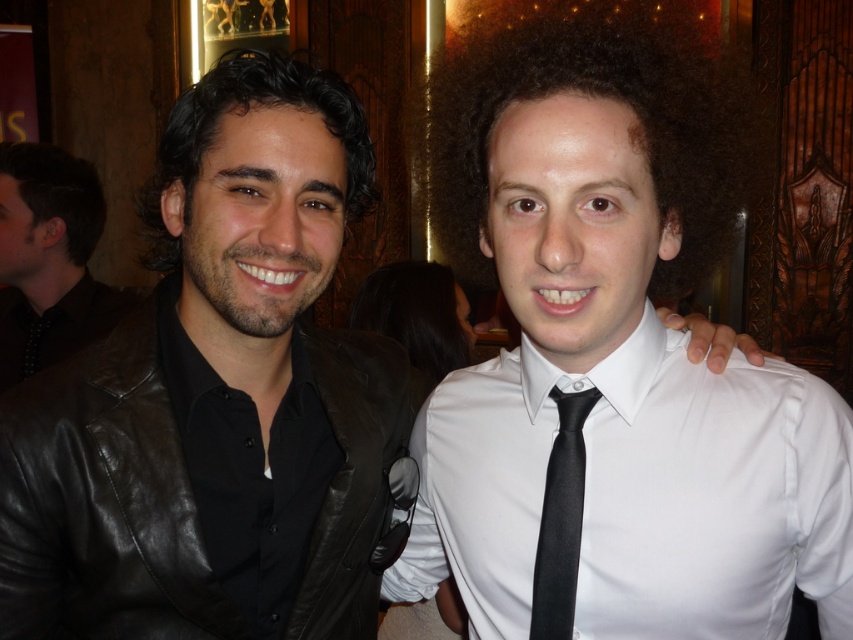
Can you confirm if black leather jacket at left is positioned below matte black jacket at left?

Yes.

Between black leather jacket at left and matte black jacket at left, which one has more height?

With more height is matte black jacket at left.

Where is `black leather jacket at left`? This screenshot has height=640, width=853. black leather jacket at left is located at coordinates point(97,500).

What are the coordinates of `black leather jacket at left` in the screenshot? It's located at tap(97, 500).

Who is lower down, white satin shirt at right or black satin tie at center?

white satin shirt at right

Can you confirm if white satin shirt at right is positioned above black satin tie at center?

No, white satin shirt at right is not above black satin tie at center.

Identify the location of white satin shirt at right. The width and height of the screenshot is (853, 640). (637, 493).

Does white satin shirt at right have a larger size compared to black leather jacket at left?

Correct, white satin shirt at right is larger in size than black leather jacket at left.

Does point (485, 564) lie behind point (173, 602)?

Yes.

Between point (468, 497) and point (343, 436), which one is positioned in front?

Point (468, 497) is more forward.

This screenshot has height=640, width=853. In order to click on white satin shirt at right in this screenshot , I will do `click(637, 493)`.